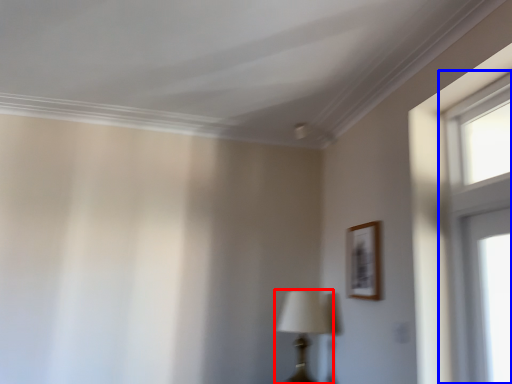
Question: Among these objects, which one is farthest to the camera, table lamp (highlighted by a red box) or window (highlighted by a blue box)?

Choices:
 (A) table lamp
 (B) window

Answer: (A)